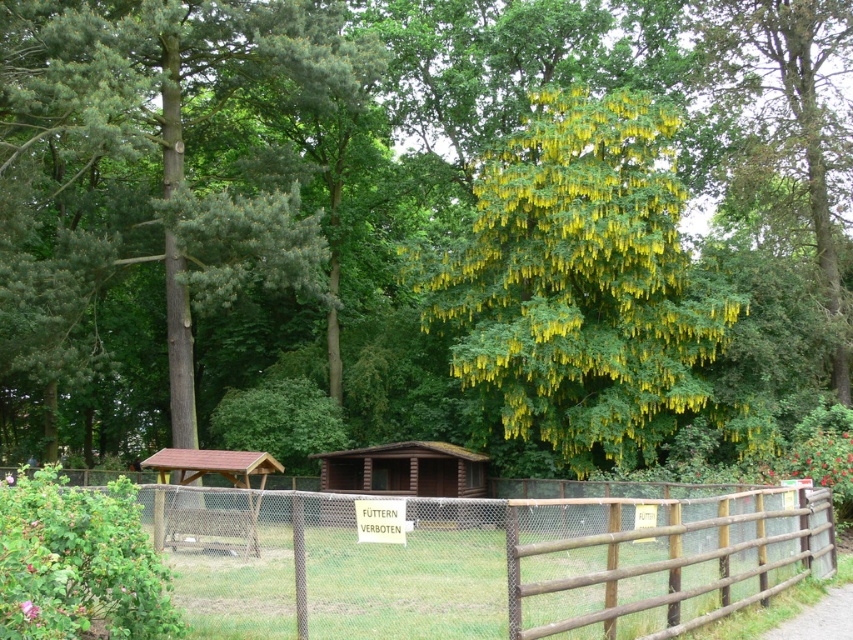
The height and width of the screenshot is (640, 853). What do you see at coordinates (152, 200) in the screenshot? I see `green needle-like at left` at bounding box center [152, 200].

Can you confirm if green needle-like at left is positioned to the left of brown wooden fence at center?

Indeed, green needle-like at left is positioned on the left side of brown wooden fence at center.

Is point (15, 196) farther from camera compared to point (529, 504)?

Yes, point (15, 196) is farther from viewer.

You are a GUI agent. You are given a task and a screenshot of the screen. Output one action in this format:
    pyautogui.click(x=<x>, y=<y>)
    Task: Click on the green needle-like at left
    The height and width of the screenshot is (640, 853).
    Given the screenshot: What is the action you would take?
    pyautogui.click(x=152, y=200)

Who is positioned more to the left, green needle-like at left or yellow matte flower at center?

Positioned to the left is green needle-like at left.

Which of these two, green needle-like at left or yellow matte flower at center, stands shorter?

Standing shorter between the two is yellow matte flower at center.

Does point (379, 49) come behind point (21, 602)?

Yes, point (379, 49) is farther from viewer.

Locate an element on the screen. This screenshot has height=640, width=853. green needle-like at left is located at coordinates (152, 200).

Does green needle-like at left have a greater height compared to brown wooden path at lower right?

Yes.

Does green needle-like at left have a larger size compared to brown wooden path at lower right?

Correct, green needle-like at left is larger in size than brown wooden path at lower right.

Who is more distant from viewer, [86,52] or [836,602]?

The point [86,52] is behind.

This screenshot has width=853, height=640. I want to click on green needle-like at left, so click(152, 200).